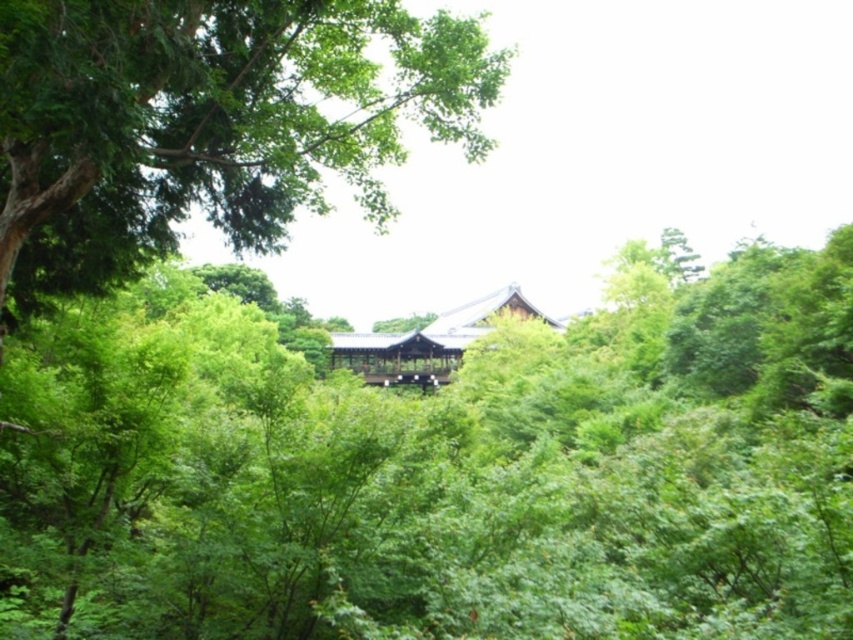
Question: Which object appears farthest from the camera in this image?

Choices:
 (A) shiny dark brown wooden hut at center
 (B) green leafy forest at center

Answer: (A)

Question: Which of the following is the farthest from the observer?

Choices:
 (A) shiny dark brown wooden hut at center
 (B) green leafy forest at center

Answer: (A)

Question: Does green leafy forest at center come in front of shiny dark brown wooden hut at center?

Choices:
 (A) no
 (B) yes

Answer: (B)

Question: Can you confirm if green leafy forest at center is positioned above shiny dark brown wooden hut at center?

Choices:
 (A) yes
 (B) no

Answer: (B)

Question: Which of the following is the farthest from the observer?

Choices:
 (A) (564, 337)
 (B) (439, 314)

Answer: (B)

Question: Is green leafy forest at center in front of shiny dark brown wooden hut at center?

Choices:
 (A) yes
 (B) no

Answer: (A)